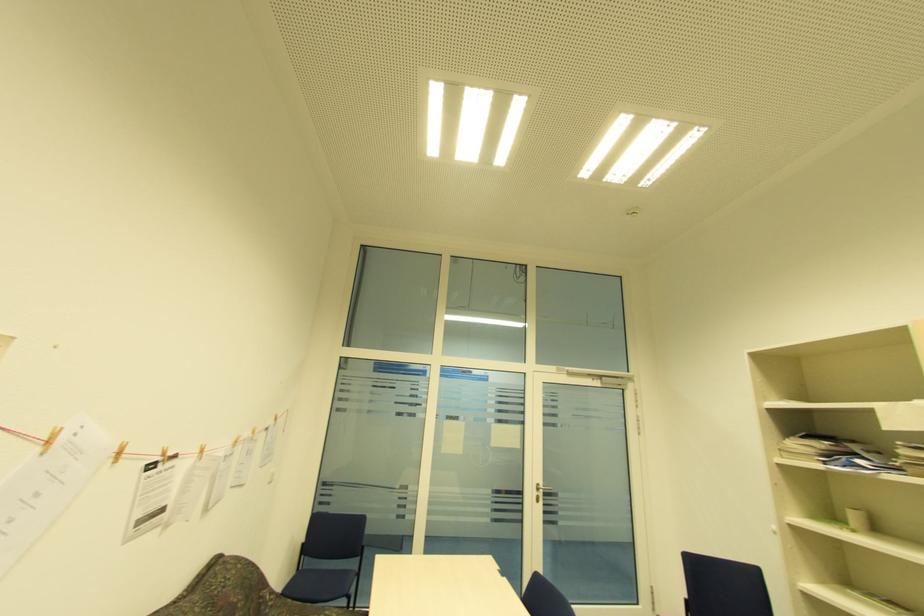
The width and height of the screenshot is (924, 616). Describe the element at coordinates (543, 488) in the screenshot. I see `the door handle` at that location.